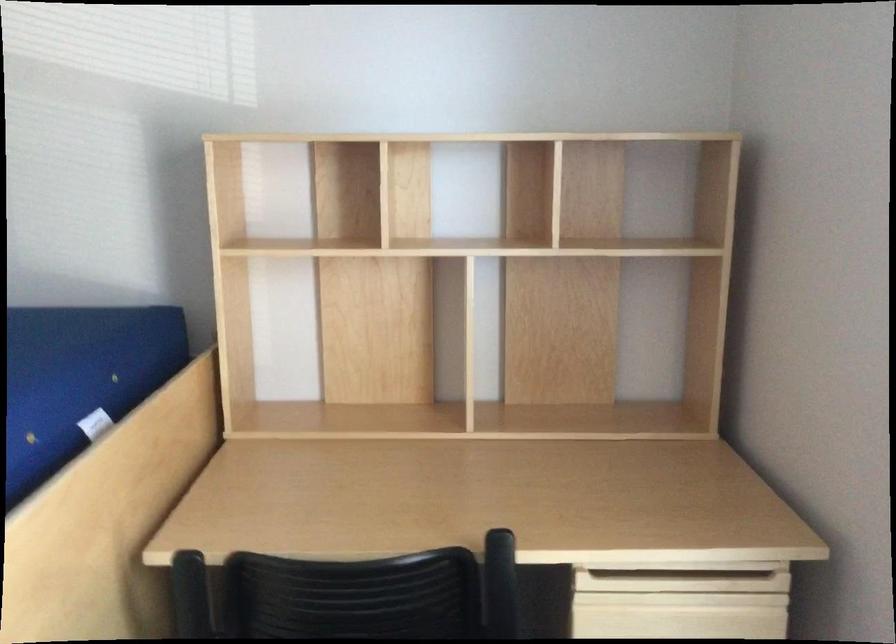
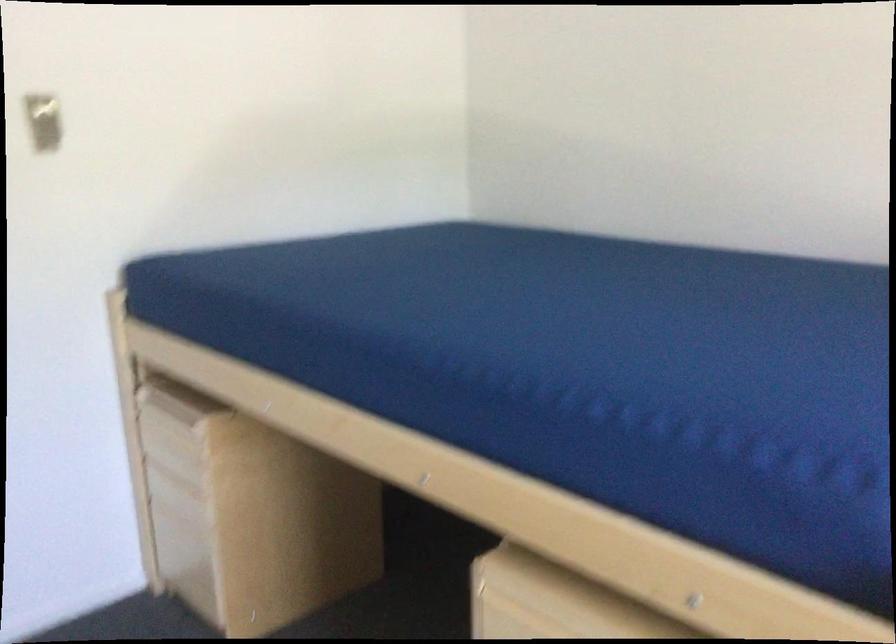
Question: The camera is either moving clockwise (left) or counter-clockwise (right) around the object. The first image is from the beginning of the video and the second image is from the end. Is the camera moving left or right when shooting the video?

Choices:
 (A) Left
 (B) Right

Answer: (B)